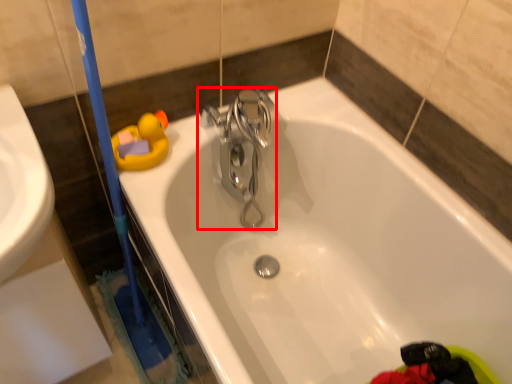
Question: From the image's perspective, where is tap (annotated by the red box) located in relation to bathtub in the image?

Choices:
 (A) below
 (B) above

Answer: (B)